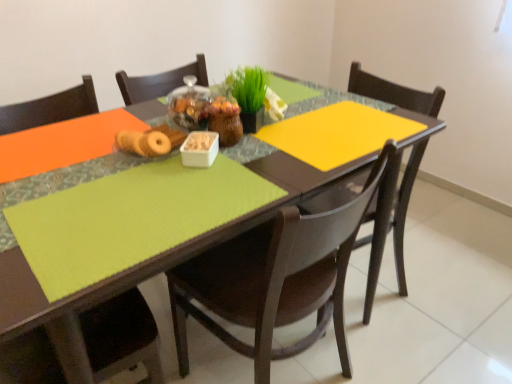
Image resolution: width=512 pixels, height=384 pixels. I want to click on free space to the right of matte wood chair at upper right, acting as the 3th chair starting from the left, so click(446, 292).